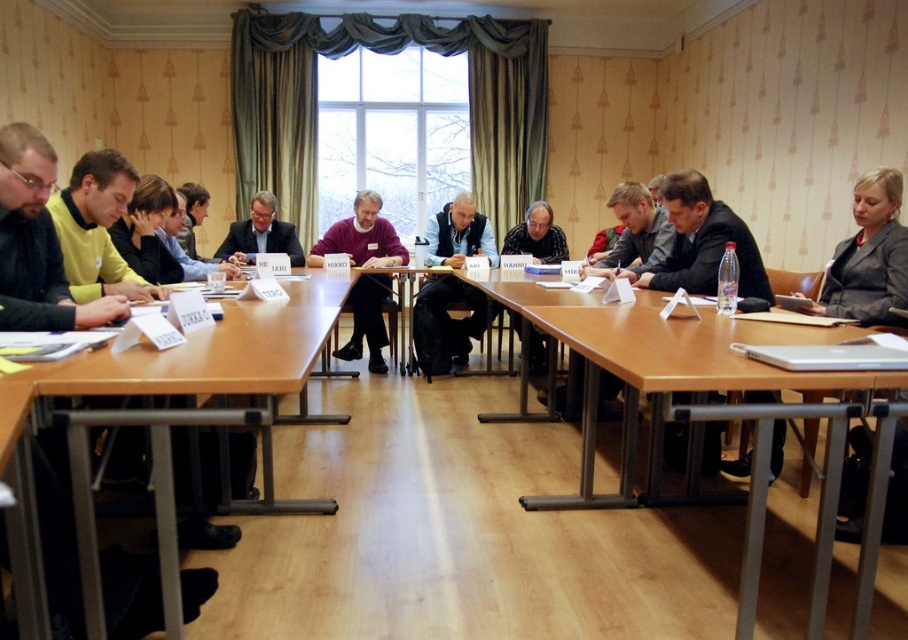
Can you confirm if brown wooden table at center is bigger than dark gray sweater at center?

Yes.

In the scene shown: Can you confirm if brown wooden table at center is positioned to the left of dark gray sweater at center?

Incorrect, brown wooden table at center is not on the left side of dark gray sweater at center.

Where is `brown wooden table at center`? brown wooden table at center is located at coordinates (706, 419).

The image size is (908, 640). What are the coordinates of `brown wooden table at center` in the screenshot? It's located at (706, 419).

Is dark gray suit at center below maroon sweater at center?

No.

Which is in front, point (630, 280) or point (349, 296)?

Point (630, 280)

Does point (749, 392) lie in front of point (364, 288)?

Yes, it is in front of point (364, 288).

Locate an element on the screen. dark gray suit at center is located at coordinates (703, 244).

Measure the distance between dark gray suit at right and black fleece vest at center.

The distance of dark gray suit at right from black fleece vest at center is 2.75 meters.

Between dark gray suit at right and black fleece vest at center, which one appears on the left side from the viewer's perspective?

black fleece vest at center

Locate an element on the screen. This screenshot has width=908, height=640. dark gray suit at right is located at coordinates (867, 257).

Image resolution: width=908 pixels, height=640 pixels. In order to click on dark gray suit at right in this screenshot , I will do `click(867, 257)`.